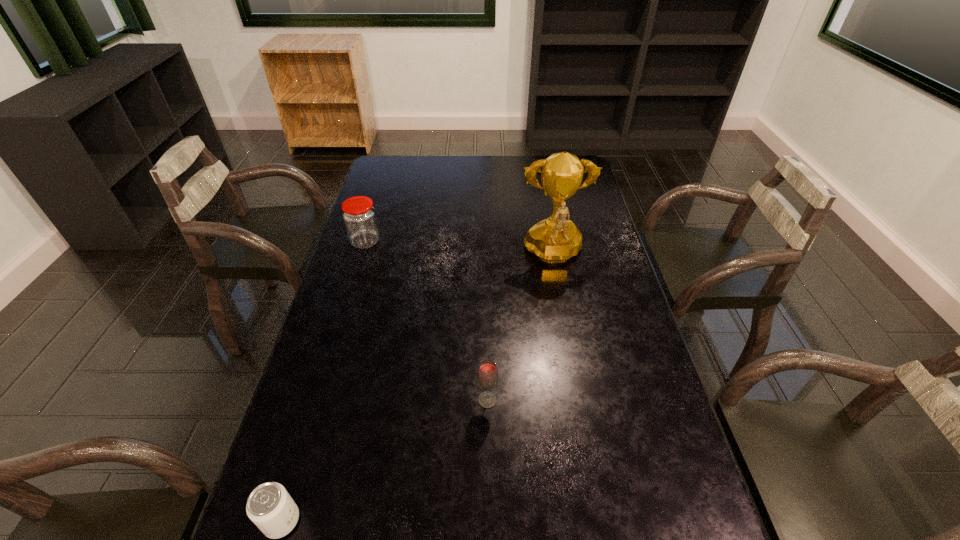
Where is `award`? The width and height of the screenshot is (960, 540). award is located at coordinates (554, 240).

The width and height of the screenshot is (960, 540). I want to click on the tallest object, so click(554, 240).

Identify the location of jar. The image size is (960, 540). (359, 216).

Find the location of a particular element. The image size is (960, 540). the second object from right to left is located at coordinates pyautogui.click(x=487, y=376).

This screenshot has height=540, width=960. Identify the location of the second nearest object. (487, 376).

Where is `vacant space located on the front side of the award`? vacant space located on the front side of the award is located at coordinates (564, 313).

Where is `vacant space located 0.240m on the front of the jar`? Image resolution: width=960 pixels, height=540 pixels. vacant space located 0.240m on the front of the jar is located at coordinates (347, 302).

You are a GUI agent. You are given a task and a screenshot of the screen. Output one action in this format:
    pyautogui.click(x=<x>, y=<y>)
    Task: Click on the vacant area located 0.290m on the back of the second object from right to left
    The image size is (960, 540).
    Given the screenshot: What is the action you would take?
    pyautogui.click(x=486, y=307)

Where is `object that is positioned at the left edge`? The width and height of the screenshot is (960, 540). object that is positioned at the left edge is located at coordinates (359, 216).

At what (x,y) coordinates should I click in order to perform the action: click on object that is positioned at the right edge. Please return your answer as a coordinate pair (x, y). Looking at the image, I should click on (554, 240).